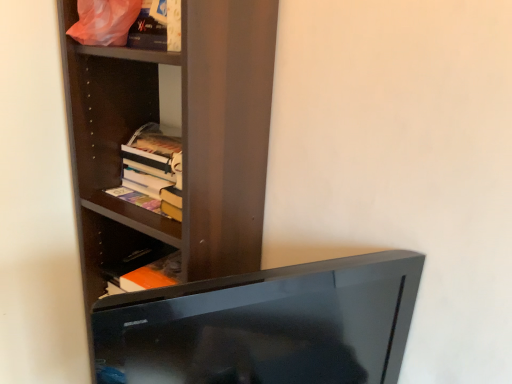
Question: Considering the relative sizes of dark wood shelf at upper left and black glossy tv at lower center in the image provided, is dark wood shelf at upper left taller than black glossy tv at lower center?

Choices:
 (A) yes
 (B) no

Answer: (A)

Question: Considering the relative sizes of dark wood shelf at upper left and black glossy tv at lower center in the image provided, is dark wood shelf at upper left smaller than black glossy tv at lower center?

Choices:
 (A) yes
 (B) no

Answer: (B)

Question: Can you confirm if dark wood shelf at upper left is wider than black glossy tv at lower center?

Choices:
 (A) yes
 (B) no

Answer: (A)

Question: Does dark wood shelf at upper left turn towards black glossy tv at lower center?

Choices:
 (A) yes
 (B) no

Answer: (B)

Question: From the image's perspective, is dark wood shelf at upper left located above black glossy tv at lower center?

Choices:
 (A) no
 (B) yes

Answer: (B)

Question: Looking at the image, does hardcover books at center-left seem bigger or smaller compared to black glossy tv at lower center?

Choices:
 (A) big
 (B) small

Answer: (B)

Question: From the image's perspective, is hardcover books at center-left above or below black glossy tv at lower center?

Choices:
 (A) below
 (B) above

Answer: (B)

Question: In the image, is hardcover books at center-left on the left side or the right side of black glossy tv at lower center?

Choices:
 (A) left
 (B) right

Answer: (A)

Question: Is hardcover books at center-left in front of or behind black glossy tv at lower center in the image?

Choices:
 (A) front
 (B) behind

Answer: (B)

Question: From the image's perspective, is hardcover books at center-left positioned above or below matte plastic bag at upper left?

Choices:
 (A) above
 (B) below

Answer: (B)

Question: Relative to matte plastic bag at upper left, is hardcover books at center-left in front or behind?

Choices:
 (A) behind
 (B) front

Answer: (A)

Question: Visually, is hardcover books at center-left positioned to the left or to the right of matte plastic bag at upper left?

Choices:
 (A) left
 (B) right

Answer: (B)

Question: Considering the positions of point tap(138, 130) and point tap(77, 6), is point tap(138, 130) closer or farther from the camera than point tap(77, 6)?

Choices:
 (A) farther
 (B) closer

Answer: (A)

Question: Looking at the image, does black glossy tv at lower center seem bigger or smaller compared to hardcover books at center-left?

Choices:
 (A) small
 (B) big

Answer: (B)

Question: Looking at their shapes, would you say black glossy tv at lower center is wider or thinner than hardcover books at center-left?

Choices:
 (A) wide
 (B) thin

Answer: (B)